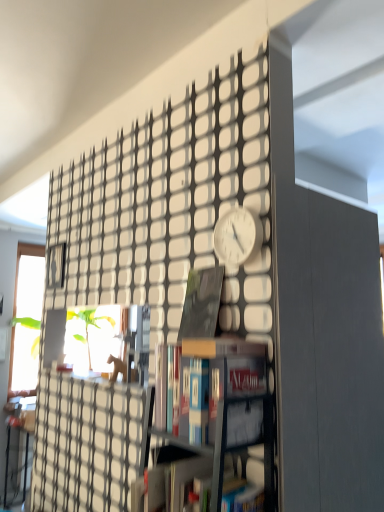
This screenshot has width=384, height=512. Describe the element at coordinates (169, 484) in the screenshot. I see `hardcover book at center, the 3th book in the top-to-bottom sequence` at that location.

What is the approximate width of white matte clock at center?

white matte clock at center is 1.37 inches wide.

Describe the element at coordinates (229, 369) in the screenshot. I see `hardcover book at center, marked as the second book in a bottom-to-top arrangement` at that location.

The height and width of the screenshot is (512, 384). I want to click on hardcover book at center, which ranks as the 1th book in bottom-to-top order, so click(x=169, y=484).

Does hardcover book at center, the 3th book in the top-to-bottom sequence, turn towards hardcover book at center, marked as the second book in a bottom-to-top arrangement?

No, hardcover book at center, the 3th book in the top-to-bottom sequence, is not facing towards hardcover book at center, marked as the second book in a bottom-to-top arrangement.

Identify the location of book in front of the hardcover book at center, the 2th book positioned from the top. (169, 484).

Is hardcover book at center, which ranks as the 1th book in bottom-to-top order, beside hardcover book at center, marked as the second book in a bottom-to-top arrangement?

No, hardcover book at center, which ranks as the 1th book in bottom-to-top order, is not touching hardcover book at center, marked as the second book in a bottom-to-top arrangement.

Between hardcover book at center, the 3th book in the top-to-bottom sequence, and hardcover book at center, marked as the second book in a bottom-to-top arrangement, which one is positioned in front?

hardcover book at center, the 3th book in the top-to-bottom sequence, is more forward.

Identify the location of book located below the hardcover book at center, the 2th book positioned from the top (from the image's perspective). This screenshot has height=512, width=384. (169, 484).

Based on their positions, is hardcover book at center, marked as the second book in a bottom-to-top arrangement, located to the left or right of hardcover book at center, the 3th book in the top-to-bottom sequence?

hardcover book at center, marked as the second book in a bottom-to-top arrangement, is positioned on hardcover book at center, the 3th book in the top-to-bottom sequence,'s right side.

Are hardcover book at center, the 2th book positioned from the top, and hardcover book at center, which ranks as the 1th book in bottom-to-top order, beside each other?

No, hardcover book at center, the 2th book positioned from the top, is not making contact with hardcover book at center, which ranks as the 1th book in bottom-to-top order.

Is matte black book at center, marked as the 1th book in a top-to-bottom arrangement, further to the viewer compared to hardcover book at center, the 3th book in the top-to-bottom sequence?

Yes, matte black book at center, marked as the 1th book in a top-to-bottom arrangement, is further from the camera.

Which of these two, matte black book at center, the 3th book in the bottom-to-top sequence, or hardcover book at center, which ranks as the 1th book in bottom-to-top order, is smaller?

With smaller size is matte black book at center, the 3th book in the bottom-to-top sequence.

Can you confirm if hardcover book at center, marked as the second book in a bottom-to-top arrangement, is thinner than matte black book at center, marked as the 1th book in a top-to-bottom arrangement?

Incorrect, the width of hardcover book at center, marked as the second book in a bottom-to-top arrangement, is not less than that of matte black book at center, marked as the 1th book in a top-to-bottom arrangement.

How far apart are hardcover book at center, marked as the second book in a bottom-to-top arrangement, and matte black book at center, the 3th book in the bottom-to-top sequence?

hardcover book at center, marked as the second book in a bottom-to-top arrangement, and matte black book at center, the 3th book in the bottom-to-top sequence, are 10.69 inches apart from each other.

Can you confirm if hardcover book at center, the 2th book positioned from the top, is positioned to the left of matte black book at center, marked as the 1th book in a top-to-bottom arrangement?

Incorrect, hardcover book at center, the 2th book positioned from the top, is not on the left side of matte black book at center, marked as the 1th book in a top-to-bottom arrangement.

Does hardcover book at center, the 2th book positioned from the top, touch matte black book at center, marked as the 1th book in a top-to-bottom arrangement?

No, hardcover book at center, the 2th book positioned from the top, is not in contact with matte black book at center, marked as the 1th book in a top-to-bottom arrangement.

Between hardcover book at center, the 3th book in the top-to-bottom sequence, and white matte clock at center, which one appears on the right side from the viewer's perspective?

white matte clock at center.

Is hardcover book at center, the 3th book in the top-to-bottom sequence, wider than white matte clock at center?

Yes.

Considering the points (178, 490) and (256, 222), which point is behind, point (178, 490) or point (256, 222)?

Point (256, 222)

From a real-world perspective, is matte black book at center, marked as the 1th book in a top-to-bottom arrangement, positioned over hardcover book at center, the 2th book positioned from the top, based on gravity?

Yes, from a real-world perspective, matte black book at center, marked as the 1th book in a top-to-bottom arrangement, is over hardcover book at center, the 2th book positioned from the top

Does matte black book at center, marked as the 1th book in a top-to-bottom arrangement, contain hardcover book at center, marked as the second book in a bottom-to-top arrangement?

That's incorrect, hardcover book at center, marked as the second book in a bottom-to-top arrangement, is not inside matte black book at center, marked as the 1th book in a top-to-bottom arrangement.

Between matte black book at center, marked as the 1th book in a top-to-bottom arrangement, and hardcover book at center, marked as the second book in a bottom-to-top arrangement, which one has more height?

matte black book at center, marked as the 1th book in a top-to-bottom arrangement.

Between matte black book at center, the 3th book in the bottom-to-top sequence, and hardcover book at center, marked as the second book in a bottom-to-top arrangement, which one is positioned in front?

hardcover book at center, marked as the second book in a bottom-to-top arrangement.

Is point (223, 277) in front of point (216, 234)?

Yes, it is in front of point (216, 234).

Choose the correct answer: Is matte black book at center, the 3th book in the bottom-to-top sequence, inside white matte clock at center or outside it?

matte black book at center, the 3th book in the bottom-to-top sequence, is spatially situated outside white matte clock at center.

From their relative heights in the image, would you say matte black book at center, the 3th book in the bottom-to-top sequence, is taller or shorter than white matte clock at center?

Considering their sizes, matte black book at center, the 3th book in the bottom-to-top sequence, has more height than white matte clock at center.

Where is `clock above the matte black book at center, marked as the 1th book in a top-to-bottom arrangement (from the image's perspective)`? clock above the matte black book at center, marked as the 1th book in a top-to-bottom arrangement (from the image's perspective) is located at coordinates (238, 236).

At what (x,y) coordinates should I click in order to perform the action: click on book below the hardcover book at center, marked as the second book in a bottom-to-top arrangement (from a real-world perspective). Please return your answer as a coordinate pair (x, y). Looking at the image, I should click on (169, 484).

You are a GUI agent. You are given a task and a screenshot of the screen. Output one action in this format:
    pyautogui.click(x=<x>, y=<y>)
    Task: Click on the book lying below the hardcover book at center, the 2th book positioned from the top (from the image's perspective)
    The image size is (384, 512).
    Given the screenshot: What is the action you would take?
    pyautogui.click(x=169, y=484)

Looking at the image, which one is located closer to white matte clock at center, matte black book at center, marked as the 1th book in a top-to-bottom arrangement, or hardcover book at center, the 2th book positioned from the top?

matte black book at center, marked as the 1th book in a top-to-bottom arrangement, lies closer to white matte clock at center than the other object.

From the image, which object appears to be nearer to hardcover book at center, which ranks as the 1th book in bottom-to-top order, hardcover book at center, the 2th book positioned from the top, or matte black book at center, marked as the 1th book in a top-to-bottom arrangement?

hardcover book at center, the 2th book positioned from the top, is closer to hardcover book at center, which ranks as the 1th book in bottom-to-top order.

Based on their spatial positions, is hardcover book at center, the 3th book in the top-to-bottom sequence, or matte black book at center, the 3th book in the bottom-to-top sequence, further from hardcover book at center, the 2th book positioned from the top?

Among the two, matte black book at center, the 3th book in the bottom-to-top sequence, is located further to hardcover book at center, the 2th book positioned from the top.

When comparing their distances from matte black book at center, the 3th book in the bottom-to-top sequence, does white matte clock at center or hardcover book at center, the 2th book positioned from the top, seem further?

hardcover book at center, the 2th book positioned from the top, is further to matte black book at center, the 3th book in the bottom-to-top sequence.

From the image, which object appears to be farther from matte black book at center, marked as the 1th book in a top-to-bottom arrangement, white matte clock at center or hardcover book at center, which ranks as the 1th book in bottom-to-top order?

hardcover book at center, which ranks as the 1th book in bottom-to-top order, is positioned further to the anchor matte black book at center, marked as the 1th book in a top-to-bottom arrangement.

Based on their spatial positions, is hardcover book at center, which ranks as the 1th book in bottom-to-top order, or white matte clock at center further from hardcover book at center, the 2th book positioned from the top?

white matte clock at center is positioned further to the anchor hardcover book at center, the 2th book positioned from the top.

Which object lies nearer to the anchor point white matte clock at center, hardcover book at center, which ranks as the 1th book in bottom-to-top order, or hardcover book at center, the 2th book positioned from the top?

hardcover book at center, the 2th book positioned from the top.

When comparing their distances from white matte clock at center, does matte black book at center, the 3th book in the bottom-to-top sequence, or hardcover book at center, the 3th book in the top-to-bottom sequence, seem closer?

matte black book at center, the 3th book in the bottom-to-top sequence, is closer to white matte clock at center.

Where is `book that lies between white matte clock at center and hardcover book at center, marked as the second book in a bottom-to-top arrangement, from top to bottom`? The height and width of the screenshot is (512, 384). book that lies between white matte clock at center and hardcover book at center, marked as the second book in a bottom-to-top arrangement, from top to bottom is located at coordinates (201, 303).

Where is `book between matte black book at center, marked as the 1th book in a top-to-bottom arrangement, and hardcover book at center, which ranks as the 1th book in bottom-to-top order, from top to bottom`? book between matte black book at center, marked as the 1th book in a top-to-bottom arrangement, and hardcover book at center, which ranks as the 1th book in bottom-to-top order, from top to bottom is located at coordinates (229, 369).